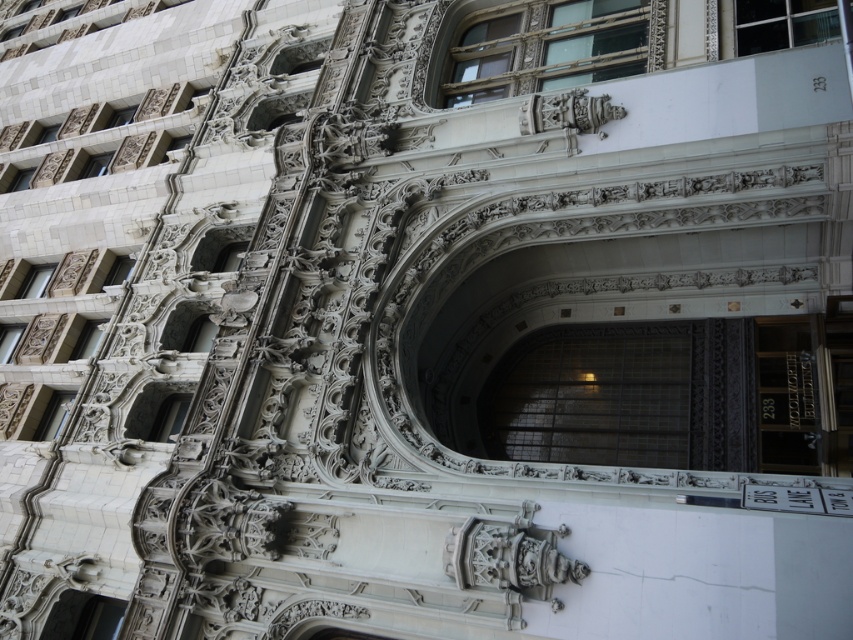
You are an architect designing a new building and need to ensure doors align with the historic style of the building shown. Given the black glass door at center and the matte glass door at lower left, which door should you prioritize in terms of height to maintain the historical aesthetic?

The black glass door at center is much taller than the matte glass door at lower left, so to maintain the historical aesthetic, prioritize the black glass door at center for its greater height as it aligns with the grandeur of the historic structure.

You are an architect examining the building facade. You notice the black glass door at center and the matte glass door at lower left. Which door is closer to you?

The black glass door at center is closer to you because it is in front of the matte glass door at lower left.

You are standing in front of the ornate building and want to know how far the point at coordinates (769, 416) is from you. Can you determine the distance?

The point at coordinates (769, 416) is 44.09 meters away from the viewer.